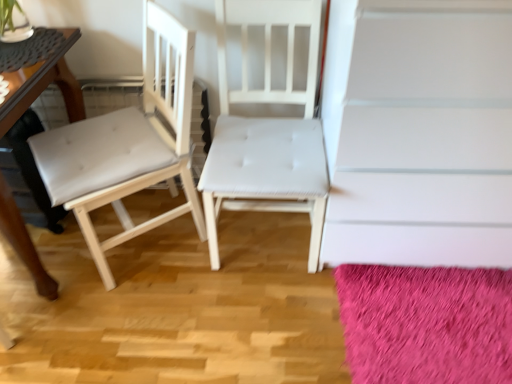
Locate an element on the screen. The width and height of the screenshot is (512, 384). white leather chair at left, which ranks as the second chair in right-to-left order is located at coordinates (129, 143).

Where is `fuzzy pink rug at lower right`? fuzzy pink rug at lower right is located at coordinates (x=426, y=323).

Is white leather chair at left, which ranks as the second chair in right-to-left order, looking in the opposite direction of fuzzy pink rug at lower right?

No, white leather chair at left, which ranks as the second chair in right-to-left order, is not facing away from fuzzy pink rug at lower right.

From the image's perspective, relative to fuzzy pink rug at lower right, is white leather chair at left, which is counted as the 1th chair, starting from the left, above or below?

white leather chair at left, which is counted as the 1th chair, starting from the left, is above fuzzy pink rug at lower right.

Does white leather chair at left, which is counted as the 1th chair, starting from the left, have a lesser height compared to fuzzy pink rug at lower right?

No.

Find the location of a particular element. Image resolution: width=512 pixels, height=384 pixels. the 2nd chair to the left of the fuzzy pink rug at lower right, starting your count from the anchor is located at coordinates (129, 143).

Considering the relative sizes of white leather chair at left, which is counted as the 1th chair, starting from the left, and wooden table at left in the image provided, is white leather chair at left, which is counted as the 1th chair, starting from the left, thinner than wooden table at left?

Yes.

From a real-world perspective, which is physically above, white leather chair at left, which is counted as the 1th chair, starting from the left, or wooden table at left?

white leather chair at left, which is counted as the 1th chair, starting from the left, is physically above.

In the scene shown: Is white leather chair at left, which is counted as the 1th chair, starting from the left, taller than wooden table at left?

Yes, white leather chair at left, which is counted as the 1th chair, starting from the left, is taller than wooden table at left.

From the picture: Which object is further away from the camera taking this photo, white leather chair at left, which ranks as the second chair in right-to-left order, or wooden table at left?

white leather chair at left, which ranks as the second chair in right-to-left order.

Is white fabric chair at center, which is the first chair from right to left, behind white matte stairwell at upper center?

Yes, the depth of white fabric chair at center, which is the first chair from right to left, is greater than that of white matte stairwell at upper center.

Can we say white fabric chair at center, placed as the second chair when sorted from left to right, lies outside white matte stairwell at upper center?

white fabric chair at center, placed as the second chair when sorted from left to right, is positioned outside white matte stairwell at upper center.

Looking at the image, does white fabric chair at center, placed as the second chair when sorted from left to right, seem bigger or smaller compared to white matte stairwell at upper center?

Clearly, white fabric chair at center, placed as the second chair when sorted from left to right, is smaller in size than white matte stairwell at upper center.

Does white fabric chair at center, which is the first chair from right to left, touch white matte stairwell at upper center?

No, white fabric chair at center, which is the first chair from right to left, is not next to white matte stairwell at upper center.

Is white leather chair at left, which is counted as the 1th chair, starting from the left, to the left of white matte stairwell at upper center from the viewer's perspective?

Yes.

Is white leather chair at left, which is counted as the 1th chair, starting from the left, wider than white matte stairwell at upper center?

No, white leather chair at left, which is counted as the 1th chair, starting from the left, is not wider than white matte stairwell at upper center.

Is white leather chair at left, which ranks as the second chair in right-to-left order, next to white matte stairwell at upper center?

No, white leather chair at left, which ranks as the second chair in right-to-left order, is not making contact with white matte stairwell at upper center.

From a real-world perspective, does white leather chair at left, which is counted as the 1th chair, starting from the left, stand above white matte stairwell at upper center?

No, from a real-world perspective, white leather chair at left, which is counted as the 1th chair, starting from the left, is not on top of white matte stairwell at upper center.

Can you tell me how much wooden table at left and white fabric chair at center, placed as the second chair when sorted from left to right, differ in facing direction?

The facing directions of wooden table at left and white fabric chair at center, placed as the second chair when sorted from left to right, are 1.01 degrees apart.

Is there a large distance between wooden table at left and white fabric chair at center, placed as the second chair when sorted from left to right?

No, wooden table at left is not far away from white fabric chair at center, placed as the second chair when sorted from left to right.

Which is more to the left, wooden table at left or white fabric chair at center, placed as the second chair when sorted from left to right?

wooden table at left is more to the left.

I want to click on chair that is the 2nd object located behind the wooden table at left, so click(x=267, y=131).

Where is `mat below the wooden table at left (from a real-world perspective)`? The width and height of the screenshot is (512, 384). mat below the wooden table at left (from a real-world perspective) is located at coordinates (426, 323).

How different are the orientations of wooden table at left and fuzzy pink rug at lower right in degrees?

1.96 degrees.

Who is smaller, wooden table at left or fuzzy pink rug at lower right?

fuzzy pink rug at lower right.

Based on the photo, which object is positioned more to the left, wooden table at left or fuzzy pink rug at lower right?

wooden table at left is more to the left.

Can wooden table at left be found inside white fabric chair at center, placed as the second chair when sorted from left to right?

No, wooden table at left is not surrounded by white fabric chair at center, placed as the second chair when sorted from left to right.

From the image's perspective, is white fabric chair at center, placed as the second chair when sorted from left to right, beneath wooden table at left?

No, from the image's perspective, white fabric chair at center, placed as the second chair when sorted from left to right, is not beneath wooden table at left.

Which object is further away from the camera taking this photo, white fabric chair at center, which is the first chair from right to left, or wooden table at left?

white fabric chair at center, which is the first chair from right to left, is further away from the camera.

Is white fabric chair at center, which is the first chair from right to left, shorter than wooden table at left?

Incorrect, the height of white fabric chair at center, which is the first chair from right to left, does not fall short of that of wooden table at left.

Where is `mat below the white leather chair at left, which is counted as the 1th chair, starting from the left (from a real-world perspective)`? mat below the white leather chair at left, which is counted as the 1th chair, starting from the left (from a real-world perspective) is located at coordinates (426, 323).

Locate an element on the screen. table to the left of white leather chair at left, which ranks as the second chair in right-to-left order is located at coordinates (42, 84).

From the image, which object appears to be nearer to white matte stairwell at upper center, white fabric chair at center, which is the first chair from right to left, or white leather chair at left, which is counted as the 1th chair, starting from the left?

white fabric chair at center, which is the first chair from right to left.

Considering their positions, is white matte stairwell at upper center positioned further to wooden table at left than fuzzy pink rug at lower right?

fuzzy pink rug at lower right lies further to wooden table at left than the other object.

Looking at the image, which one is located further to white leather chair at left, which ranks as the second chair in right-to-left order, white matte stairwell at upper center or white fabric chair at center, placed as the second chair when sorted from left to right?

Among the two, white matte stairwell at upper center is located further to white leather chair at left, which ranks as the second chair in right-to-left order.

Estimate the real-world distances between objects in this image. Which object is further from fuzzy pink rug at lower right, white leather chair at left, which ranks as the second chair in right-to-left order, or white fabric chair at center, which is the first chair from right to left?

white leather chair at left, which ranks as the second chair in right-to-left order, lies further to fuzzy pink rug at lower right than the other object.

From the image, which object appears to be farther from white leather chair at left, which ranks as the second chair in right-to-left order, wooden table at left or white matte stairwell at upper center?

white matte stairwell at upper center.

Based on their spatial positions, is fuzzy pink rug at lower right or white matte stairwell at upper center further from wooden table at left?

fuzzy pink rug at lower right is further to wooden table at left.

Considering their positions, is white matte stairwell at upper center positioned further to white fabric chair at center, placed as the second chair when sorted from left to right, than white leather chair at left, which ranks as the second chair in right-to-left order?

white matte stairwell at upper center is further to white fabric chair at center, placed as the second chair when sorted from left to right.

Which object lies further to the anchor point white leather chair at left, which ranks as the second chair in right-to-left order, wooden table at left or fuzzy pink rug at lower right?

Based on the image, fuzzy pink rug at lower right appears to be further to white leather chair at left, which ranks as the second chair in right-to-left order.

Locate an element on the screen. chair situated between white leather chair at left, which ranks as the second chair in right-to-left order, and fuzzy pink rug at lower right from left to right is located at coordinates (267, 131).

Find the location of `chair situated between white leather chair at left, which ranks as the second chair in right-to-left order, and white matte stairwell at upper center from left to right`. chair situated between white leather chair at left, which ranks as the second chair in right-to-left order, and white matte stairwell at upper center from left to right is located at coordinates (267, 131).

You are a GUI agent. You are given a task and a screenshot of the screen. Output one action in this format:
    pyautogui.click(x=<x>, y=<y>)
    Task: Click on the chair between wooden table at left and white fabric chair at center, placed as the second chair when sorted from left to right, in the horizontal direction
    This screenshot has width=512, height=384.
    Given the screenshot: What is the action you would take?
    pos(129,143)

Locate an element on the screen. mat located between white leather chair at left, which ranks as the second chair in right-to-left order, and white matte stairwell at upper center in the left-right direction is located at coordinates (426, 323).